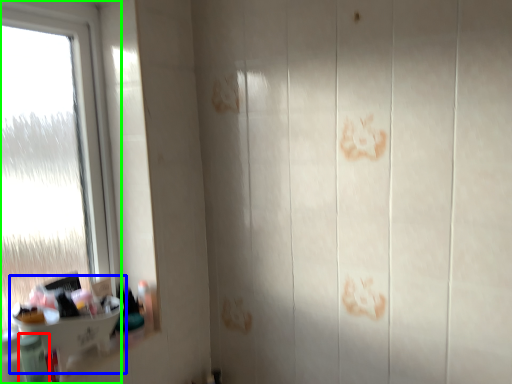
Question: Which object is the farthest from toiletry (highlighted by a red box)? Choose among these: sink (highlighted by a blue box) or window (highlighted by a green box).

Choices:
 (A) sink
 (B) window

Answer: (B)